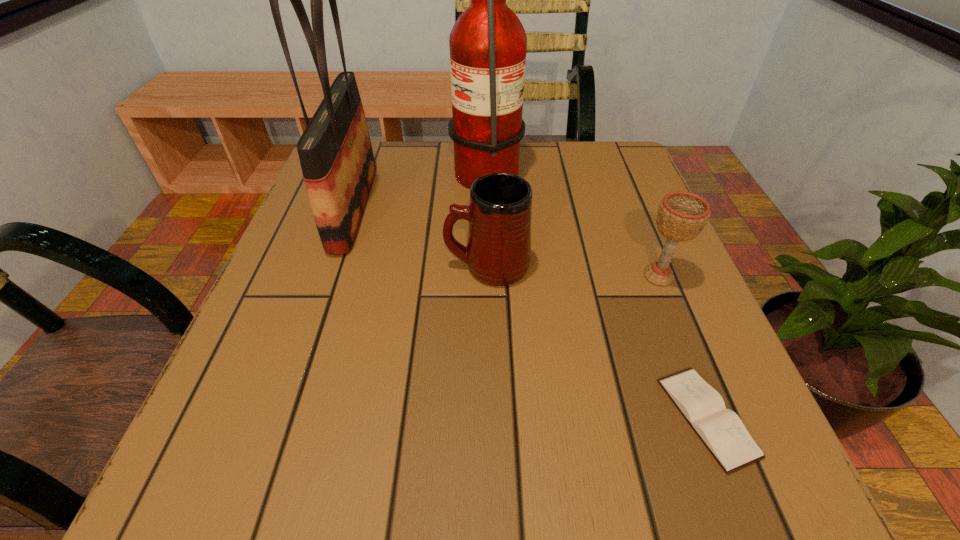
I want to click on empty space between the shopping bag and the mug, so click(x=420, y=237).

Where is `vacant space that is in between the fire extinguisher and the shortest object`? vacant space that is in between the fire extinguisher and the shortest object is located at coordinates (596, 292).

Find the location of `free spot between the leftmost object and the mug`. free spot between the leftmost object and the mug is located at coordinates (420, 237).

Find the location of a particular element. The image size is (960, 540). empty location between the mug and the chalice is located at coordinates (573, 271).

At what (x,y) coordinates should I click in order to perform the action: click on free spot between the fire extinguisher and the shopping bag. Please return your answer as a coordinate pair (x, y). The height and width of the screenshot is (540, 960). Looking at the image, I should click on (420, 187).

Image resolution: width=960 pixels, height=540 pixels. What are the coordinates of `free space between the diary and the mug` in the screenshot? It's located at (597, 342).

Identify which object is the fourth nearest to the fire extinguisher. Please provide its 2D coordinates. Your answer should be formatted as a tuple, i.e. [(x, y)], where the tuple contains the x and y coordinates of a point satisfying the conditions above.

[(721, 430)]

Identify the location of object that stands as the third closest to the fourth shortest object. (681, 216).

Locate an element on the screen. This screenshot has width=960, height=540. blank area in the image that satisfies the following two spatial constraints: 1. on the front-facing side of the chalice; 2. on the left side of the leftmost object is located at coordinates (330, 276).

This screenshot has height=540, width=960. I want to click on vacant space that satisfies the following two spatial constraints: 1. on the side of the mug with the handle; 2. on the left side of the chalice, so pyautogui.click(x=488, y=276).